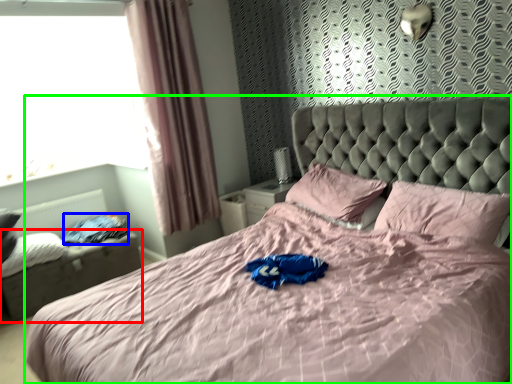
Question: Which is farther away from footrest (highlighted by a red box)? clothing (highlighted by a blue box) or bed (highlighted by a green box)?

Choices:
 (A) clothing
 (B) bed

Answer: (B)